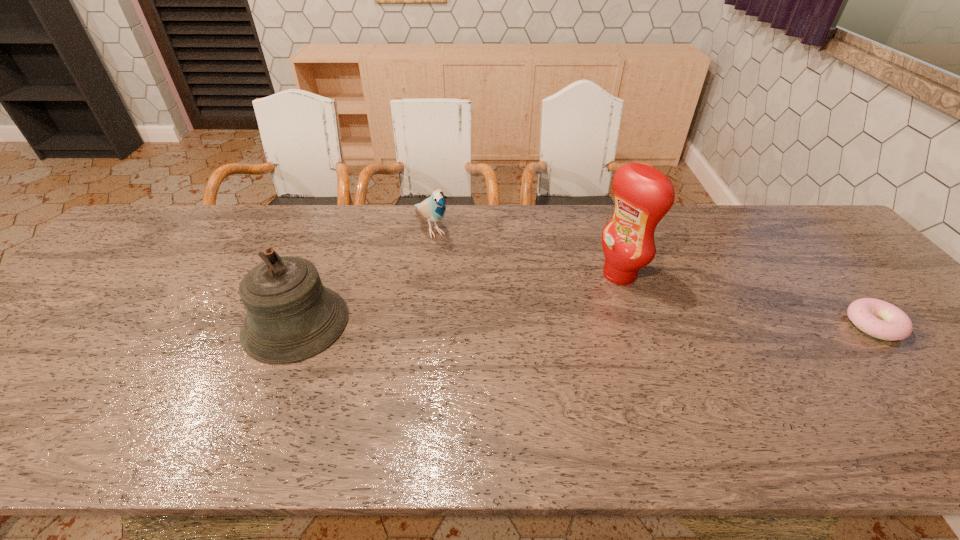
Where is `the third shortest object`? This screenshot has height=540, width=960. the third shortest object is located at coordinates (291, 316).

Locate an element on the screen. bell is located at coordinates click(291, 316).

The width and height of the screenshot is (960, 540). I want to click on the rightmost object, so click(877, 318).

The image size is (960, 540). I want to click on the shortest object, so (877, 318).

Find the location of a particular element. the third object from left to right is located at coordinates point(643,195).

This screenshot has width=960, height=540. Identify the location of condiment. (643, 195).

Identify the location of the farthest object. (433, 208).

At what (x,y) coordinates should I click in order to perform the action: click on bird. Please return your answer as a coordinate pair (x, y). This screenshot has width=960, height=540. Looking at the image, I should click on (433, 208).

The image size is (960, 540). Find the location of `free point located 0.340m on the left of the leftmost object`. free point located 0.340m on the left of the leftmost object is located at coordinates (108, 323).

In order to click on vacant position located 0.080m on the left of the rightmost object in this screenshot , I will do `click(816, 325)`.